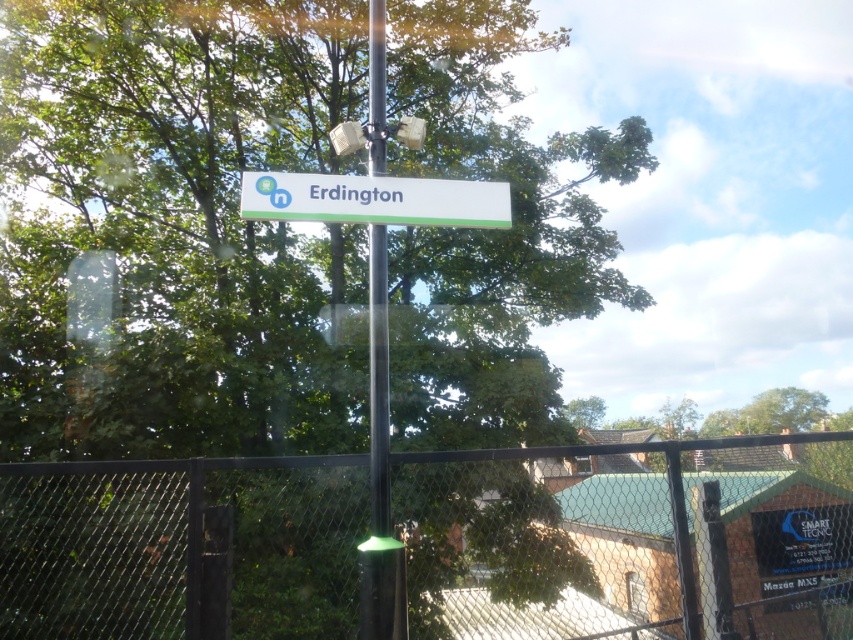
Does black chain-link fence at center have a greater width compared to white plastic sign at center?

Indeed, black chain-link fence at center has a greater width compared to white plastic sign at center.

Is black chain-link fence at center to the right of white plastic sign at center from the viewer's perspective?

Correct, you'll find black chain-link fence at center to the right of white plastic sign at center.

The image size is (853, 640). What do you see at coordinates (415, 547) in the screenshot?
I see `black chain-link fence at center` at bounding box center [415, 547].

At what (x,y) coordinates should I click in order to perform the action: click on black chain-link fence at center. Please return your answer as a coordinate pair (x, y). The width and height of the screenshot is (853, 640). Looking at the image, I should click on (415, 547).

The width and height of the screenshot is (853, 640). I want to click on black metallic pole at center, so click(x=380, y=472).

You are a GUI agent. You are given a task and a screenshot of the screen. Output one action in this format:
    pyautogui.click(x=<x>, y=<y>)
    Task: Click on the black metallic pole at center
    This screenshot has width=853, height=640.
    Given the screenshot: What is the action you would take?
    pyautogui.click(x=380, y=472)

Does black chain-link fence at center lie behind black metallic pole at center?

Yes, black chain-link fence at center is behind black metallic pole at center.

Who is more forward, (447,611) or (386,588)?

Point (386,588)

I want to click on black chain-link fence at center, so click(x=415, y=547).